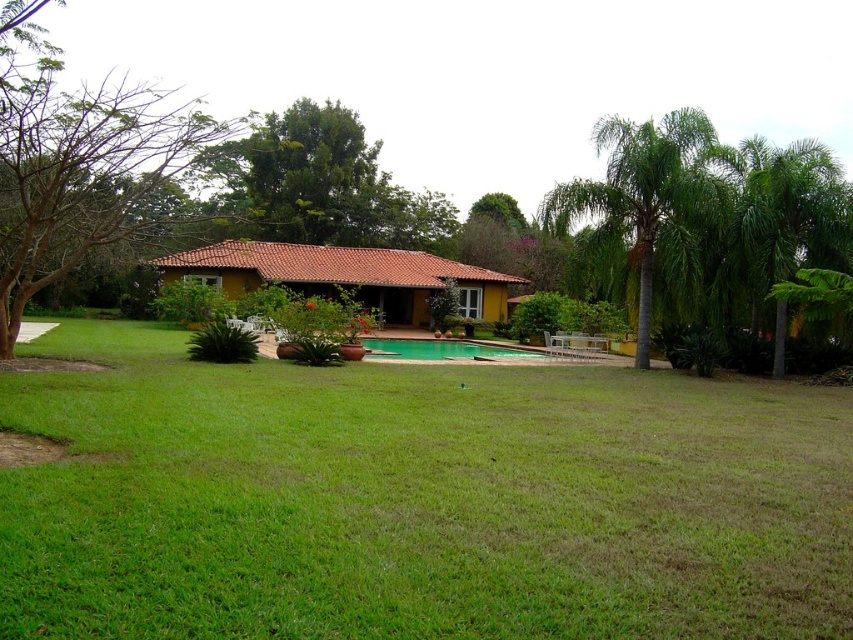
Question: Is the position of green grass at center more distant than that of bare branches at left?

Choices:
 (A) yes
 (B) no

Answer: (B)

Question: Is bare branches at left to the right of green glossy pool at center from the viewer's perspective?

Choices:
 (A) no
 (B) yes

Answer: (A)

Question: Which object is positioned farthest from the bare branches at left?

Choices:
 (A) green glossy pool at center
 (B) green grass at center

Answer: (A)

Question: Is green grass at center below green leafy palm tree at right?

Choices:
 (A) no
 (B) yes

Answer: (B)

Question: Which of the following is the farthest from the observer?

Choices:
 (A) (434, 340)
 (B) (158, 120)

Answer: (A)

Question: Which point is farther from the camera taking this photo?

Choices:
 (A) tap(372, 355)
 (B) tap(482, 525)
 (C) tap(589, 253)
 (D) tap(16, 131)

Answer: (A)